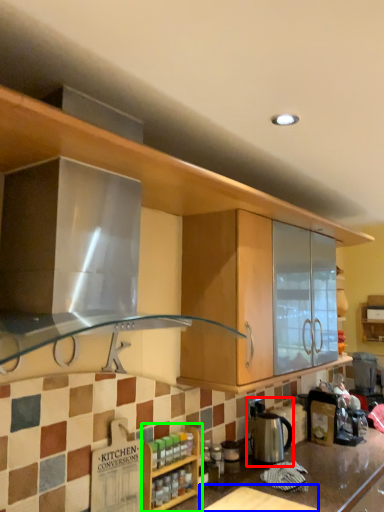
Question: Which is farther away from appliance (highlighted by a red box)? table (highlighted by a blue box) or cabinetry (highlighted by a green box)?

Choices:
 (A) table
 (B) cabinetry

Answer: (B)